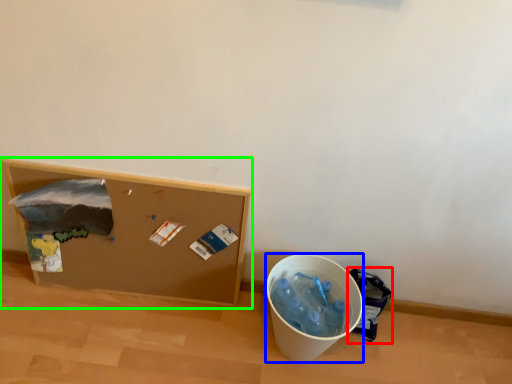
Question: Which is nearer to the garbage (highlighted by a red box)? recycling bin (highlighted by a blue box) or furniture (highlighted by a green box).

Choices:
 (A) recycling bin
 (B) furniture

Answer: (A)